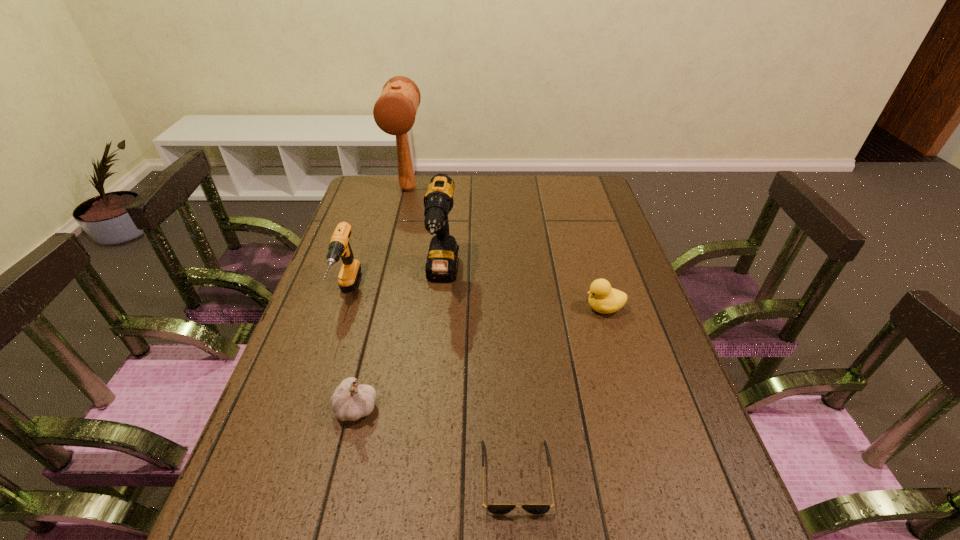
Image resolution: width=960 pixels, height=540 pixels. Identify the location of the nearest object. [x=496, y=509].

The image size is (960, 540). Find the location of `sunglasses`. sunglasses is located at coordinates (496, 509).

Find the location of a particular element. The height and width of the screenshot is (540, 960). vacant space positioned 0.090m on the strike surface of the farthest object is located at coordinates (401, 218).

The image size is (960, 540). I want to click on vacant space located at the tip of the right drill, so click(430, 402).

The image size is (960, 540). I want to click on free region located at the tip of the third tallest object, so click(x=321, y=374).

Identify the location of vacant space located 0.200m on the right of the third shortest object. (469, 408).

Find the location of a particular element. This screenshot has height=540, width=960. free space located on the front-facing side of the second shortest object is located at coordinates (533, 308).

Identify the location of free space located on the front-facing side of the second shortest object. Image resolution: width=960 pixels, height=540 pixels. (515, 308).

Identify the location of free space located on the front-facing side of the second shortest object. (489, 308).

Identify the location of object at the far edge. pyautogui.click(x=394, y=112).